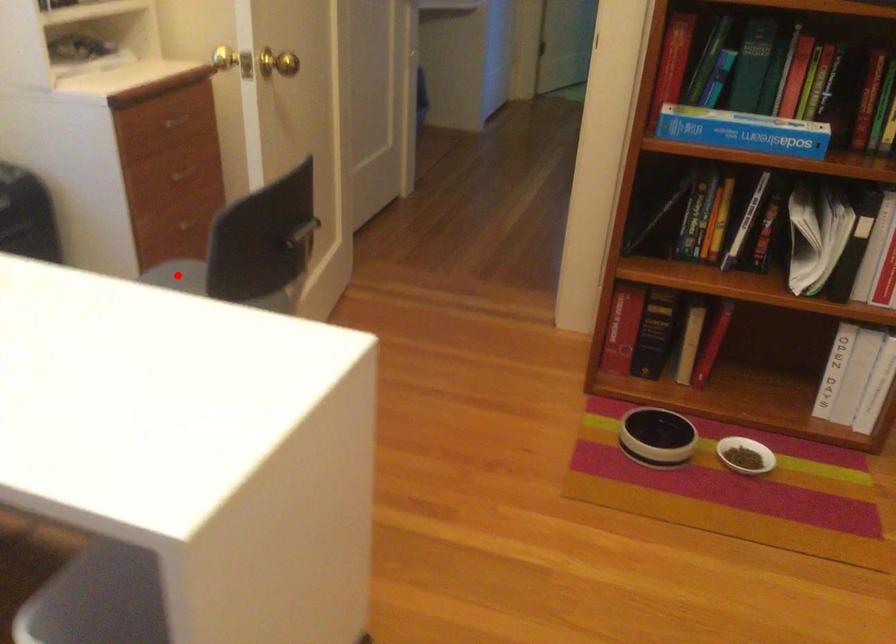
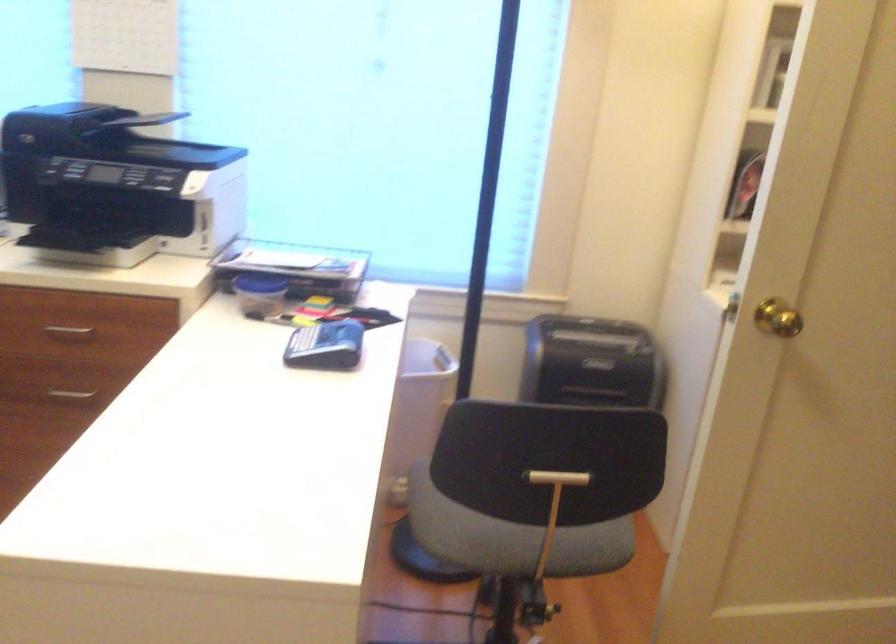
Question: I am providing you with two images of the same scene from different viewpoints. A red point is marked on the first image. At the location where the point appears in image 1, is it still visible in image 2?

Choices:
 (A) Yes
 (B) No

Answer: (B)